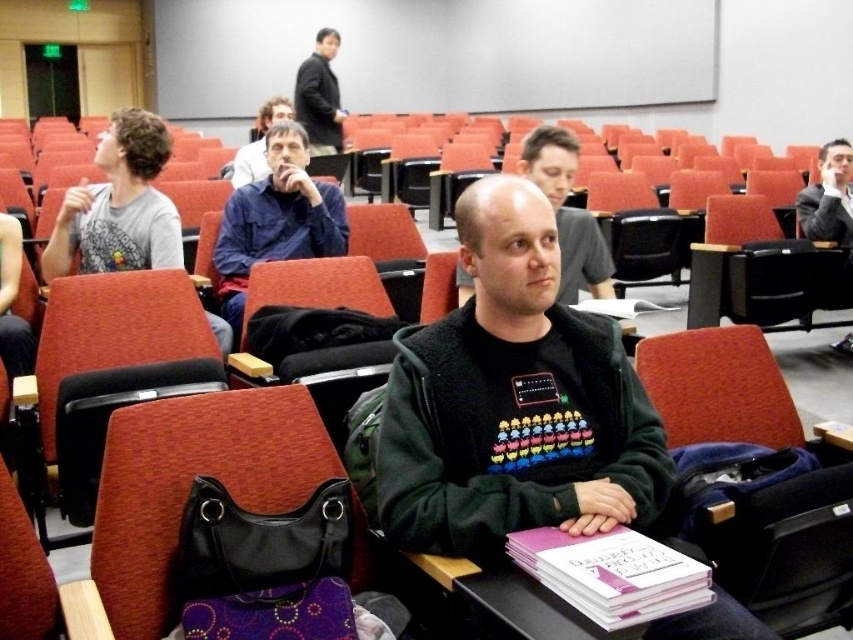
Consider the image. You are standing at the entrance of the lecture hall and see the point marked at coordinates (276, 220). What object or person is located at that point?

The blue cotton shirt at center is located at the point marked at coordinates (276, 220).

Consider the image. You are standing at the entrance of the lecture hall and see the point marked at coordinates (276, 220). What is the object located at that point?

The point at coordinates (276, 220) corresponds to the blue cotton shirt at center.

You are standing in the lecture hall and want to pick up an item from the table. You see two points on the table labeled as point (187, 484) and point (734, 280). Which point is closer to you?

Point (187, 484) is closer to the viewer than point (734, 280).